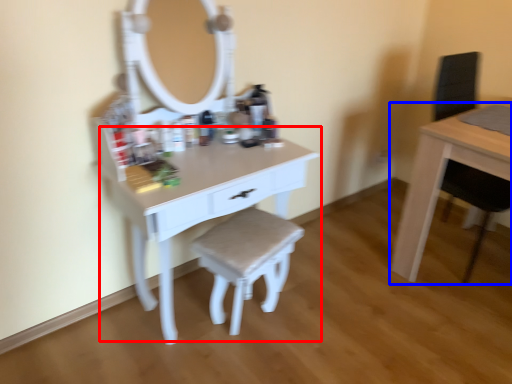
Question: Among these objects, which one is farthest to the camera, table (highlighted by a red box) or table (highlighted by a blue box)?

Choices:
 (A) table
 (B) table

Answer: (B)